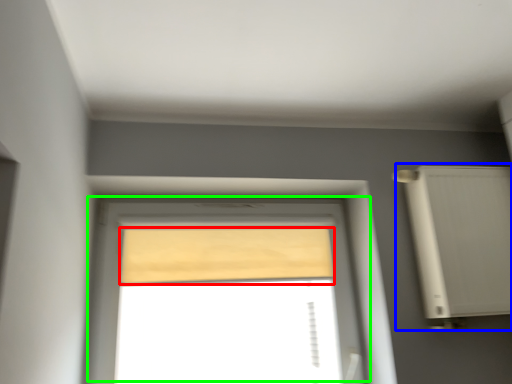
Question: Based on their relative distances, which object is farther from curtain (highlighted by a red box)? Choose from air conditioner (highlighted by a blue box) and window (highlighted by a green box).

Choices:
 (A) air conditioner
 (B) window

Answer: (A)